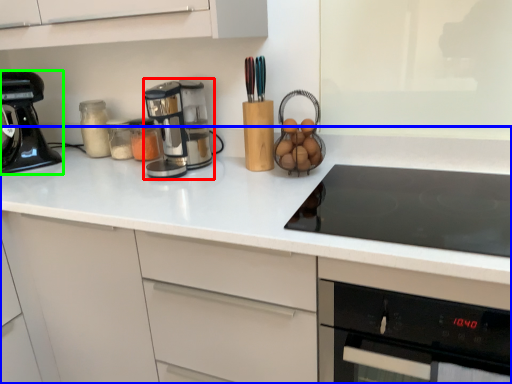
Question: Which object is the farthest from kitchen appliance (highlighted by a red box)? Choose among these: countertop (highlighted by a blue box) or kitchen appliance (highlighted by a green box).

Choices:
 (A) countertop
 (B) kitchen appliance

Answer: (B)